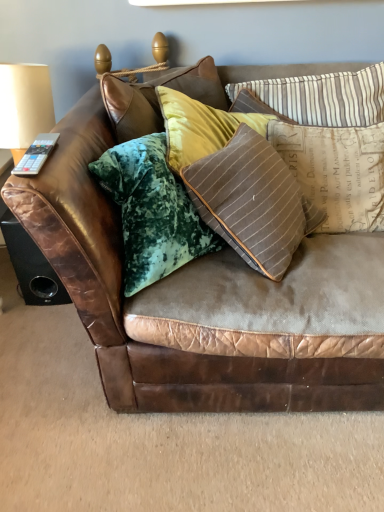
Question: From the image's perspective, is brown striped pillow at upper right, arranged as the second pillow when viewed from the top, on brown leather speaker at lower left?

Choices:
 (A) yes
 (B) no

Answer: (A)

Question: Is brown striped pillow at upper right, arranged as the second pillow when viewed from the top, in contact with brown leather speaker at lower left?

Choices:
 (A) yes
 (B) no

Answer: (B)

Question: Considering the relative sizes of brown striped pillow at upper right, arranged as the second pillow when viewed from the top, and brown leather speaker at lower left in the image provided, is brown striped pillow at upper right, arranged as the second pillow when viewed from the top, smaller than brown leather speaker at lower left?

Choices:
 (A) yes
 (B) no

Answer: (B)

Question: From a real-world perspective, is brown striped pillow at upper right, arranged as the second pillow when viewed from the top, beneath brown leather speaker at lower left?

Choices:
 (A) no
 (B) yes

Answer: (A)

Question: Does brown striped pillow at upper right, arranged as the second pillow when viewed from the top, have a greater width compared to brown leather speaker at lower left?

Choices:
 (A) no
 (B) yes

Answer: (B)

Question: From a real-world perspective, is brown leather couch at center above or below brown striped pillow at upper right, arranged as the second pillow when viewed from the top?

Choices:
 (A) below
 (B) above

Answer: (A)

Question: Based on their positions, is brown leather couch at center located to the left or right of brown striped pillow at upper right, positioned as the first pillow in bottom-to-top order?

Choices:
 (A) left
 (B) right

Answer: (A)

Question: Would you say brown leather couch at center is inside or outside brown striped pillow at upper right, arranged as the second pillow when viewed from the top?

Choices:
 (A) inside
 (B) outside

Answer: (B)

Question: In terms of width, does brown leather couch at center look wider or thinner when compared to brown striped pillow at upper right, arranged as the second pillow when viewed from the top?

Choices:
 (A) thin
 (B) wide

Answer: (B)

Question: Considering the relative positions of striped fabric pillow at upper right, placed as the first pillow when sorted from top to bottom, and gray plastic remote at upper left in the image provided, is striped fabric pillow at upper right, placed as the first pillow when sorted from top to bottom, to the left or to the right of gray plastic remote at upper left?

Choices:
 (A) left
 (B) right

Answer: (B)

Question: From the image's perspective, is striped fabric pillow at upper right, placed as the first pillow when sorted from top to bottom, above or below gray plastic remote at upper left?

Choices:
 (A) above
 (B) below

Answer: (A)

Question: In terms of size, does striped fabric pillow at upper right, which appears as the second pillow when ordered from the bottom, appear bigger or smaller than gray plastic remote at upper left?

Choices:
 (A) small
 (B) big

Answer: (B)

Question: Is point (352, 75) positioned closer to the camera than point (28, 163)?

Choices:
 (A) farther
 (B) closer

Answer: (A)

Question: Is brown leather speaker at lower left wider or thinner than brown leather couch at center?

Choices:
 (A) wide
 (B) thin

Answer: (B)

Question: From the image's perspective, is brown leather speaker at lower left positioned above or below brown leather couch at center?

Choices:
 (A) above
 (B) below

Answer: (B)